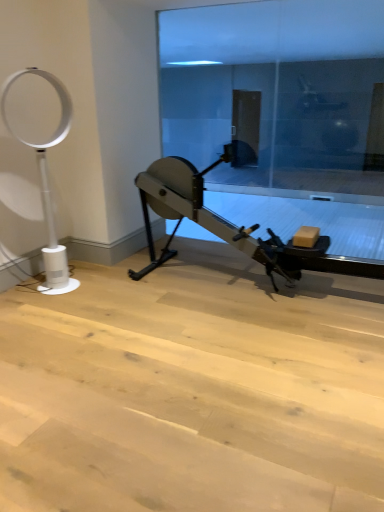
Find the location of a particular element. The width and height of the screenshot is (384, 512). vacant space in front of white plastic fan at left is located at coordinates (61, 304).